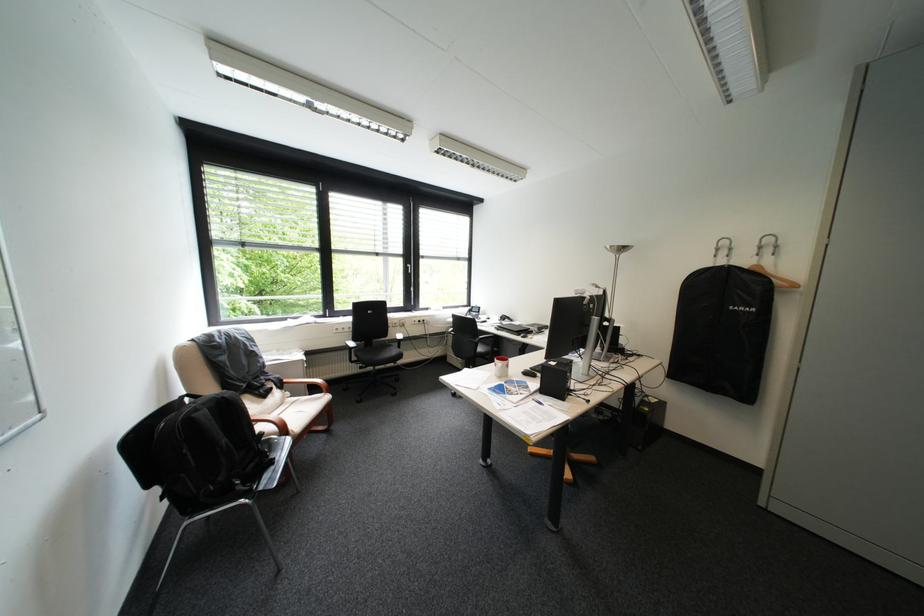
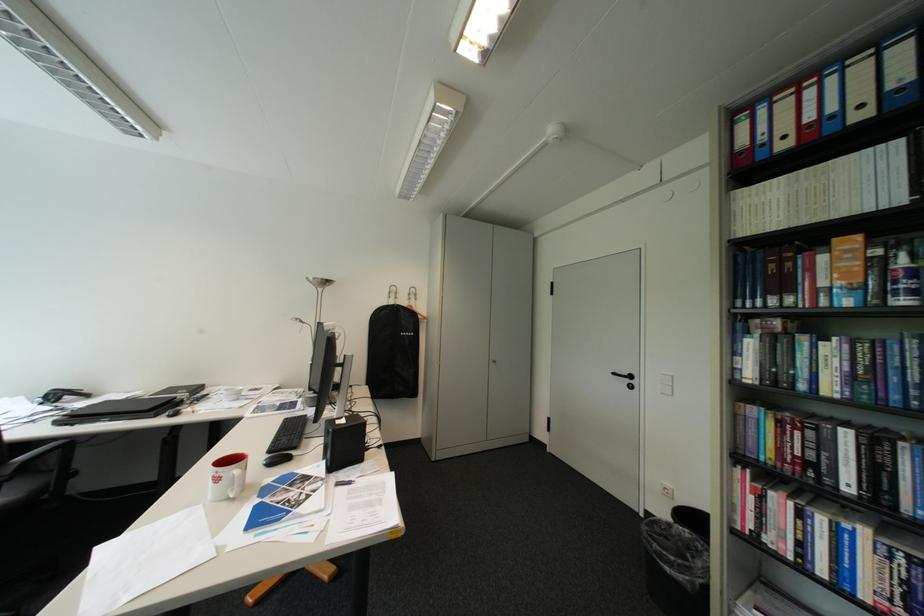
The point at (719, 262) is marked in the first image. Where is the corresponding point in the second image?

(395, 302)